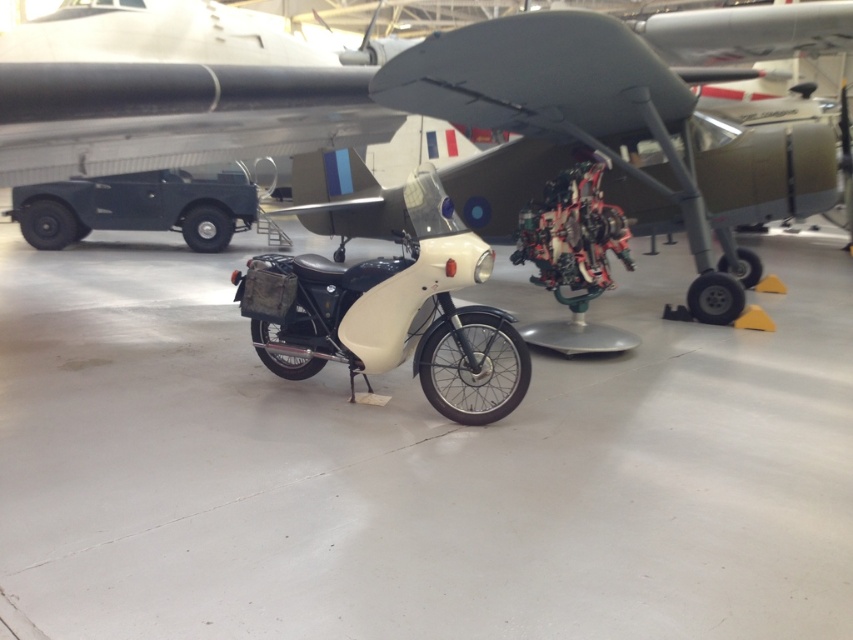
You are standing in the museum and want to take a photo of the vintage motorcycle. You notice two points marked in the scene. The first point is at coordinates point (55, 145) and the second point is at point (248, 308). Which point is closer to you?

Point (55, 145) is further to the camera than point (248, 308), so the closer point to you is point (248, 308).

From the picture: You are a security guard in the museum and need to move the white matte motorcycle at center to a different exhibit. The path to the new exhibit requires passing through a doorway that is exactly the same size as the motorcycle. Can the metallic gray airplane at center also fit through this doorway? Explain your reasoning.

The metallic gray airplane at center is bigger than the white matte motorcycle at center. Since the doorway is exactly the same size as the motorcycle, the airplane cannot fit through the doorway because it is larger than the motorcycle.

You are an architect designing a new museum layout. You need to place a new exhibit stand at point 0.131, 0.419. However, you see the metallic gray airplane at center. Is there a conflict in placement?

The metallic gray airplane at center is already positioned at point (357, 83), so placing the new exhibit stand at that location would conflict with the existing airplane.